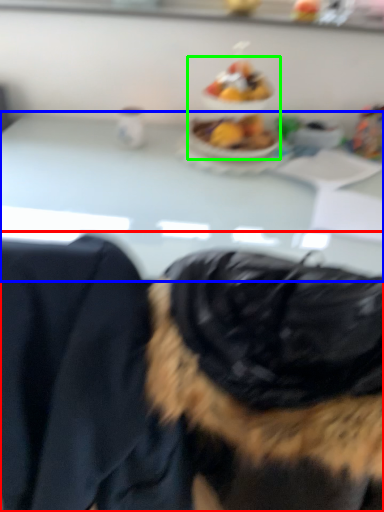
Question: Which object is the farthest from dog (highlighted by a red box)? Choose among these: table (highlighted by a blue box) or food (highlighted by a green box).

Choices:
 (A) table
 (B) food

Answer: (B)